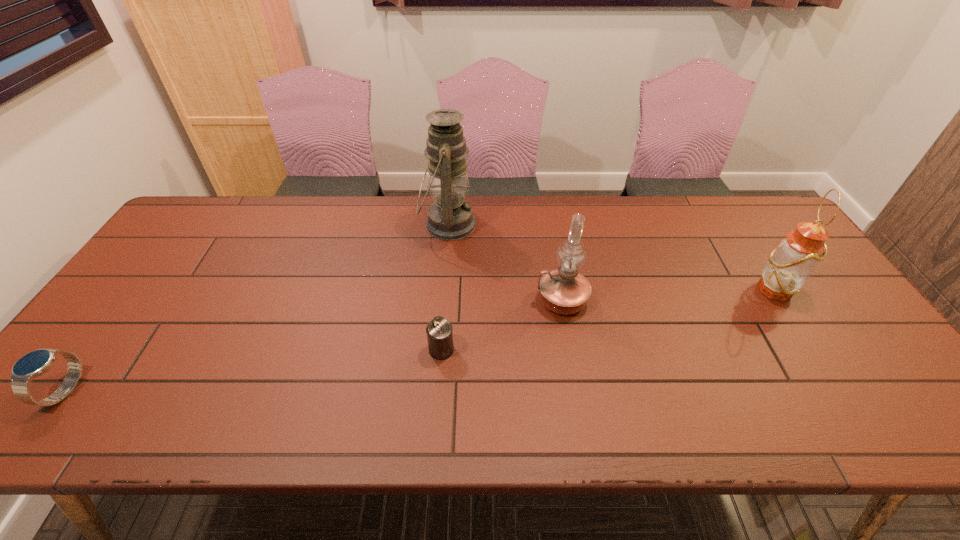
Find the location of a particular element. vacant space at the right edge is located at coordinates 876,353.

Where is `free space at the far left corner of the desktop`? free space at the far left corner of the desktop is located at coordinates (214, 220).

Find the location of a particular element. The height and width of the screenshot is (540, 960). free space between the farthest oil lamp and the can is located at coordinates (444, 287).

Locate an element on the screen. This screenshot has height=540, width=960. free space between the watch and the tallest object is located at coordinates (257, 307).

Identify the location of free area in between the farthest oil lamp and the watch. (257, 307).

Locate an element on the screen. vacant point located between the can and the rightmost oil lamp is located at coordinates (608, 319).

Where is `blank region between the rightmost object and the leftmost object`? The image size is (960, 540). blank region between the rightmost object and the leftmost object is located at coordinates (420, 340).

Locate an element on the screen. This screenshot has height=540, width=960. empty location between the can and the second object from right to left is located at coordinates (502, 325).

I want to click on free spot between the farthest object and the rightmost object, so click(611, 257).

At what (x,y) coordinates should I click in order to perform the action: click on vacant region between the second nearest object and the rightmost oil lamp. Please return your answer as a coordinate pair (x, y). The image size is (960, 540). Looking at the image, I should click on (608, 319).